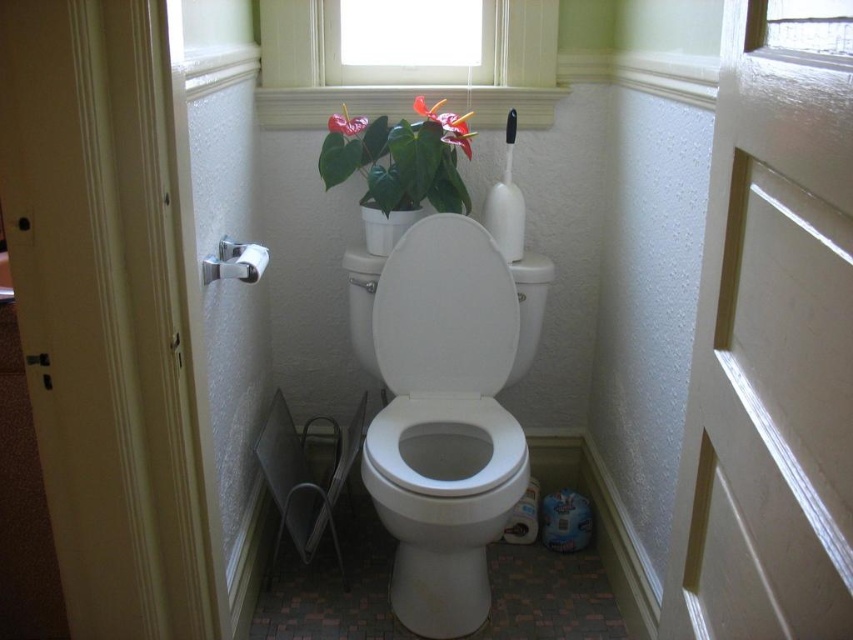
Question: Which object appears farthest from the camera in this image?

Choices:
 (A) white glossy toilet at center
 (B) white glossy toilet lid at center

Answer: (B)

Question: Based on their relative distances, which object is farther from the white glossy toilet lid at center?

Choices:
 (A) white glossy toilet at center
 (B) white painted wood at upper right

Answer: (B)

Question: Is white glossy toilet at center to the right of green glossy leafy plant at upper center from the viewer's perspective?

Choices:
 (A) no
 (B) yes

Answer: (B)

Question: Which is farther from the white glossy toilet bowl at center?

Choices:
 (A) white glossy toilet lid at center
 (B) white glossy toilet at center
 (C) leather-like red flower at upper center

Answer: (C)

Question: Can you confirm if white glossy toilet bowl at center is positioned below green matte leaf at center?

Choices:
 (A) yes
 (B) no

Answer: (A)

Question: Is white glossy toilet lid at center above green glossy leafy plant at upper center?

Choices:
 (A) yes
 (B) no

Answer: (B)